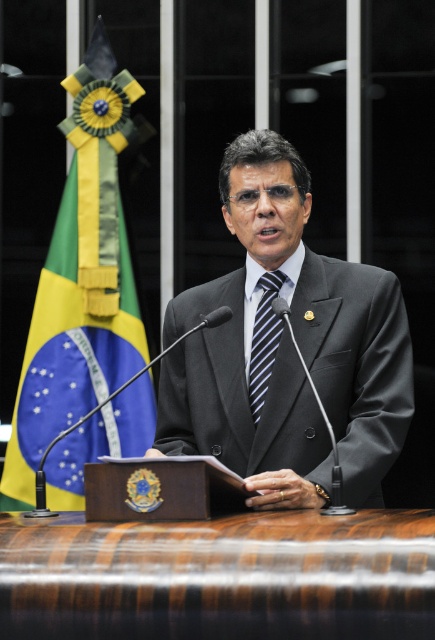
Question: Which point is closer to the camera?

Choices:
 (A) dark gray suit at center
 (B) blue striped tie at center
 (C) green/yellow fabric flag at left

Answer: (A)

Question: Does dark gray suit at center appear on the right side of green/yellow fabric flag at left?

Choices:
 (A) yes
 (B) no

Answer: (A)

Question: Observing the image, what is the correct spatial positioning of dark gray suit at center in reference to green/yellow fabric flag at left?

Choices:
 (A) above
 (B) below

Answer: (B)

Question: Which of the following is the farthest from the observer?

Choices:
 (A) (140, 342)
 (B) (308, 467)

Answer: (A)

Question: Is dark gray suit at center above green/yellow fabric flag at left?

Choices:
 (A) yes
 (B) no

Answer: (B)

Question: Which point is farther from the camera taking this photo?

Choices:
 (A) (256, 326)
 (B) (240, 221)

Answer: (A)